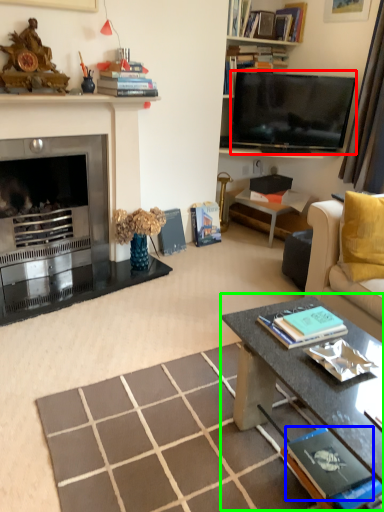
Question: Which is nearer to the television (highlighted by a red box)? book (highlighted by a blue box) or coffee table (highlighted by a green box).

Choices:
 (A) book
 (B) coffee table

Answer: (B)